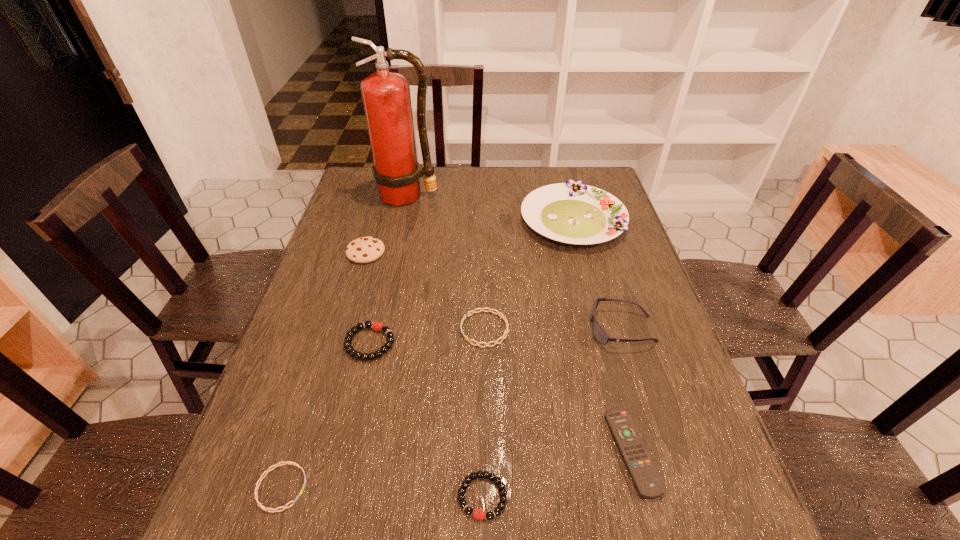
At what (x,y) coordinates should I click in order to perform the action: click on blank space located 0.220m on the right of the brown cookie. Please return your answer as a coordinate pair (x, y). The height and width of the screenshot is (540, 960). Looking at the image, I should click on (459, 252).

Locate an element on the screen. This screenshot has height=540, width=960. free space located 0.330m on the back of the farther black bracelet is located at coordinates (394, 242).

Where is `free region located on the surface of the right blue bracelet showing star-shaped elements`? The height and width of the screenshot is (540, 960). free region located on the surface of the right blue bracelet showing star-shaped elements is located at coordinates (330, 329).

The width and height of the screenshot is (960, 540). Identify the location of free space located 0.310m on the surface of the right blue bracelet showing star-shaped elements. (335, 329).

This screenshot has height=540, width=960. What are the coordinates of `free region located 0.240m on the surface of the right blue bracelet showing star-shaped elements` in the screenshot? It's located at pyautogui.click(x=363, y=329).

Where is `vacant region located on the back of the nearer black bracelet`? The image size is (960, 540). vacant region located on the back of the nearer black bracelet is located at coordinates (482, 398).

Image resolution: width=960 pixels, height=540 pixels. What are the coordinates of `free location located on the left of the remote control` in the screenshot? It's located at (581, 452).

Identify the location of vacant space located on the surface of the nearer blue bracelet showing star-shaped elements. (442, 487).

Identify the location of fire extinguisher located in the far edge section of the desktop. (386, 96).

This screenshot has height=540, width=960. I want to click on salad plate that is at the far edge, so click(x=572, y=212).